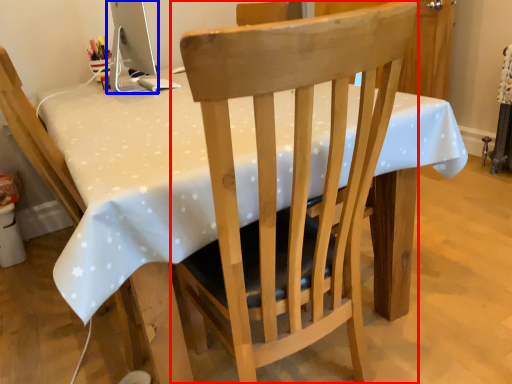
Question: Which object is closer to the camera taking this photo, chair (highlighted by a red box) or computer monitor (highlighted by a blue box)?

Choices:
 (A) chair
 (B) computer monitor

Answer: (A)